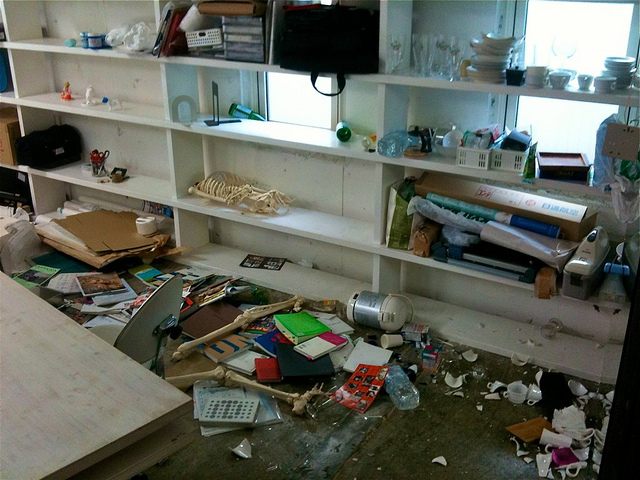
Find the location of a particular element. Image resolution: width=640 pixels, height=480 pixels. wall is located at coordinates tap(320, 176), tap(329, 259), tap(137, 157), tap(132, 88), tap(86, 8), tap(493, 302).